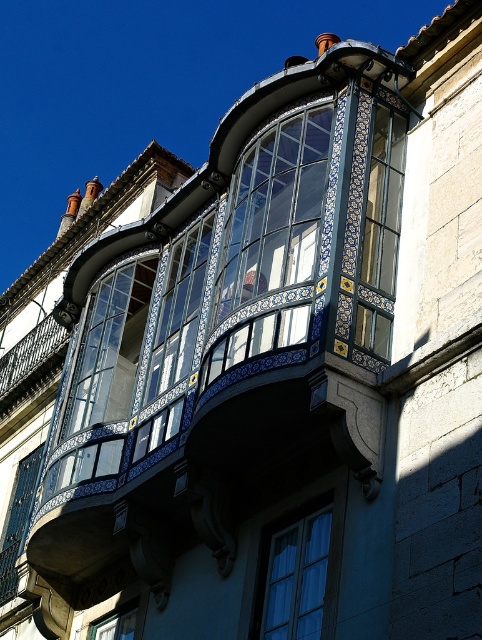
You are standing in front of the bay window and want to place a small decoration. You have two points marked on the window where you can place it. Which point is closer to you, point (387, 189) or point (202, 257)?

Point (387, 189) is closer to the viewer than point (202, 257), so you should place the decoration there if you want it to be closer.

You are standing in front of the building and want to take a photo that includes both point (280, 166) and point (102, 621). Which point will appear larger in your photo?

Point (280, 166) is closer to the camera than point (102, 621), so it will appear larger in the photo.

You are an architect inspecting the building facade. You notice the blue glass window at center and the clear glass window at lower center. Which window is positioned higher up on the building?

The blue glass window at center is positioned higher up on the building because it is above the clear glass window at lower center.